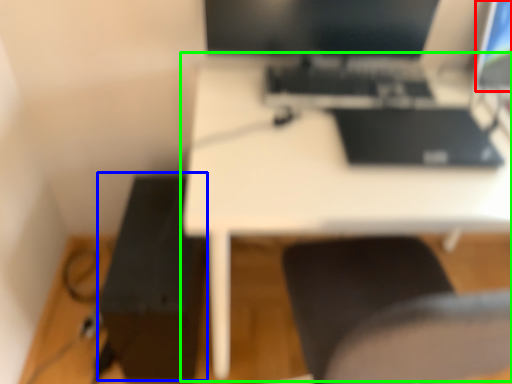
Question: Estimate the real-world distances between objects in this image. Which object is closer to computer screen (highlighted by a red box), printer (highlighted by a blue box) or table (highlighted by a green box)?

Choices:
 (A) printer
 (B) table

Answer: (B)